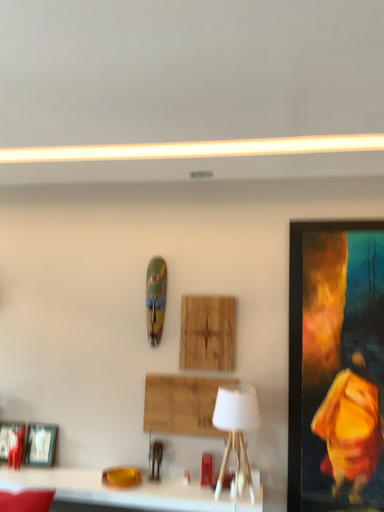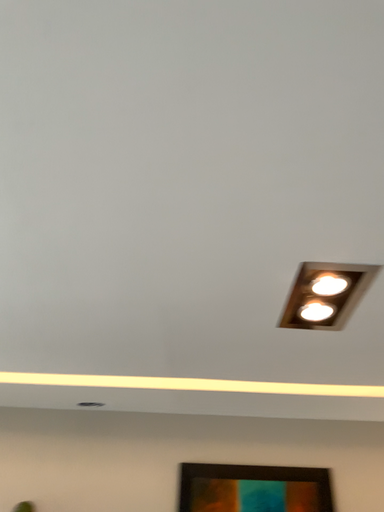
Question: Which way did the camera rotate in the video?

Choices:
 (A) rotated downward
 (B) rotated upward

Answer: (B)